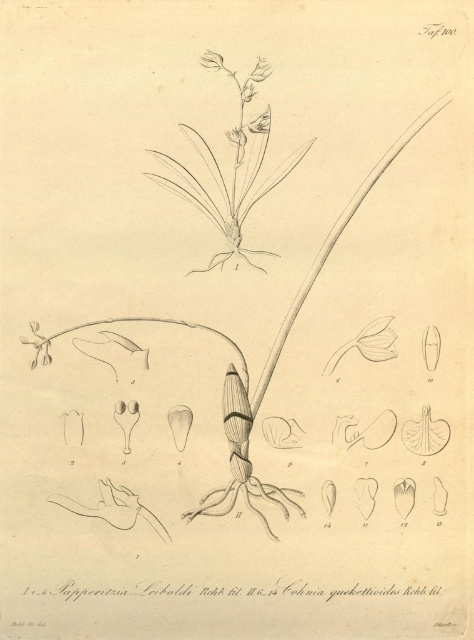
You are a botanist examining a botanical illustration. You need to determine if the gray sketch orchid at center is positioned closer to the edge of the paper than the matte white petal at center. Can you confirm this based on the illustration?

The distance between the gray sketch orchid at center and the matte white petal at center is 12.95 inches. Since both are at the center, they are equidistant from the edge of the paper, so neither is closer.

You are a botanist examining the botanical illustration. You notice the matte white petal at center and the matte white flower at lower left. Which of these two has a greater height?

The matte white petal at center is taller than the matte white flower at lower left according to the illustration.